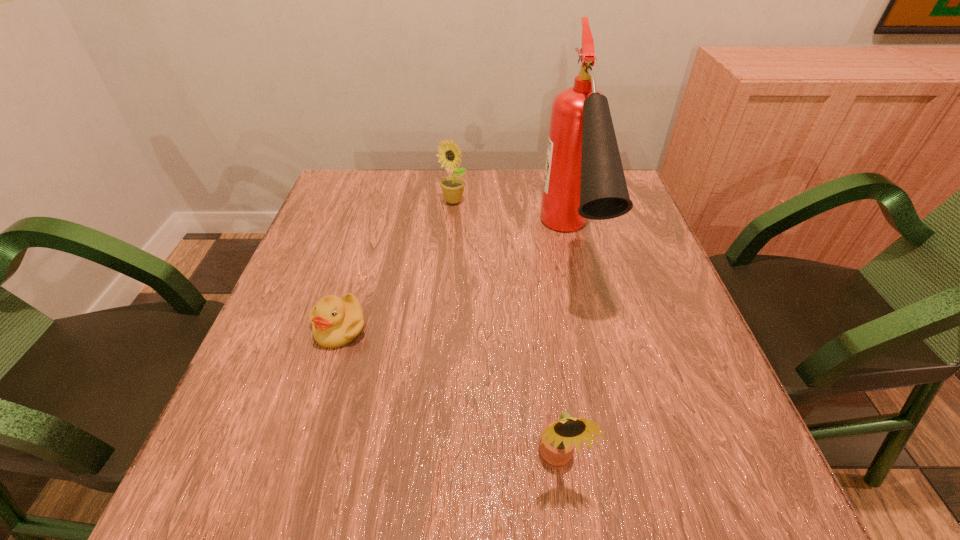
The height and width of the screenshot is (540, 960). Identify the location of vacant space at the right edge of the desktop. (606, 267).

Where is `vacant region at the far left corner of the desktop`? The image size is (960, 540). vacant region at the far left corner of the desktop is located at coordinates (356, 202).

Image resolution: width=960 pixels, height=540 pixels. In order to click on vacant point at the near right corner in this screenshot , I will do `click(766, 518)`.

I want to click on vacant area that lies between the tallest object and the leftmost object, so click(455, 287).

Where is `vacant point located between the duckling and the left sunflower`? Image resolution: width=960 pixels, height=540 pixels. vacant point located between the duckling and the left sunflower is located at coordinates (396, 264).

You are a GUI agent. You are given a task and a screenshot of the screen. Output one action in this format:
    pyautogui.click(x=<x>, y=<y>)
    Task: Click on the unoccupied position between the leftmost object and the fire extinguisher
    
    Given the screenshot: What is the action you would take?
    pyautogui.click(x=455, y=287)

Identify the location of empty location between the leftmost object and the fire extinguisher. (455, 287).

Locate an element on the screen. Image resolution: width=960 pixels, height=540 pixels. free space between the tallest object and the nearer sunflower is located at coordinates (563, 353).

Find the location of `vacant space that's between the left sunflower and the tallest object`. vacant space that's between the left sunflower and the tallest object is located at coordinates (512, 224).

This screenshot has width=960, height=540. I want to click on unoccupied area between the leftmost object and the nearer sunflower, so click(448, 394).